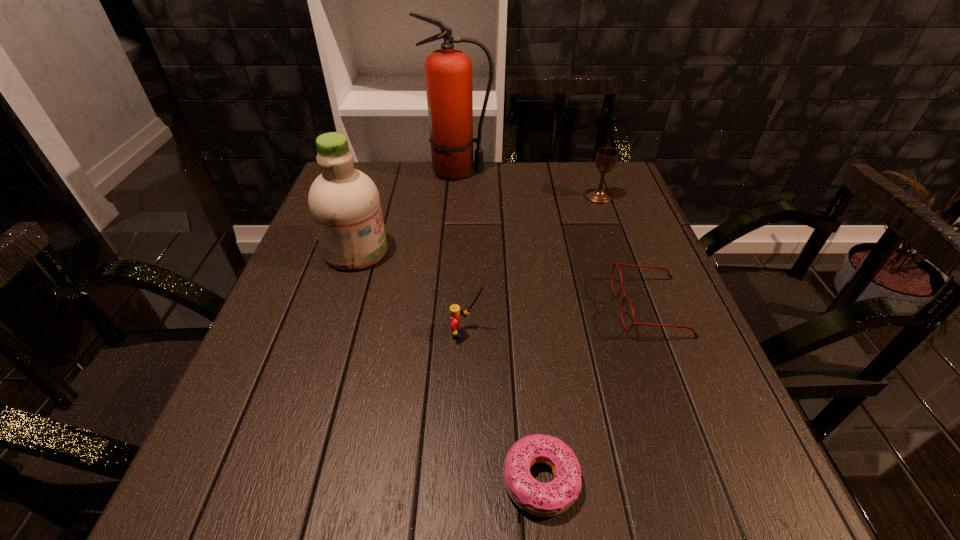
The height and width of the screenshot is (540, 960). Find the location of `vacant area that lies between the shortest object and the third shortest object`. vacant area that lies between the shortest object and the third shortest object is located at coordinates (504, 407).

Locate which object is the fourth closest to the second shortest object. Please provide its 2D coordinates. Your answer should be formatted as a tuple, i.e. [(x, y)], where the tuple contains the x and y coordinates of a point satisfying the conditions above.

[(448, 72)]

Locate an element on the screen. The height and width of the screenshot is (540, 960). object that is the fifth closest to the leftmost object is located at coordinates (606, 158).

Find the location of a particular element. The image size is (960, 540). free space that satisfies the following two spatial constraints: 1. on the front-facing side of the nearest object; 2. on the left side of the fourth tallest object is located at coordinates (463, 480).

Where is `free space in the image that satisfies the following two spatial constraints: 1. on the front-facing side of the nearest object; 2. on the left side of the Lego`? free space in the image that satisfies the following two spatial constraints: 1. on the front-facing side of the nearest object; 2. on the left side of the Lego is located at coordinates (463, 480).

The width and height of the screenshot is (960, 540). Identify the location of vacant area that satisfies the following two spatial constraints: 1. on the face of the fifth tallest object; 2. on the front side of the shortest object. tap(717, 480).

Where is `free region that satisfies the following two spatial constraints: 1. on the nozzle of the shortest object; 2. on the left side of the farthest object`? The width and height of the screenshot is (960, 540). free region that satisfies the following two spatial constraints: 1. on the nozzle of the shortest object; 2. on the left side of the farthest object is located at coordinates [x=435, y=480].

Identify the location of vacant position in the image that satisfies the following two spatial constraints: 1. on the front label of the fourth nearest object; 2. on the back side of the shortest object. This screenshot has width=960, height=540. [x=283, y=480].

Where is `free space that satisfies the following two spatial constraints: 1. on the front-facing side of the doughnut; 2. on the right side of the Lego`? free space that satisfies the following two spatial constraints: 1. on the front-facing side of the doughnut; 2. on the right side of the Lego is located at coordinates (463, 480).

This screenshot has height=540, width=960. In order to click on free spot that satisfies the following two spatial constraints: 1. on the nozzle of the fourth shortest object; 2. on the right side of the tallest object in this screenshot , I will do `click(456, 197)`.